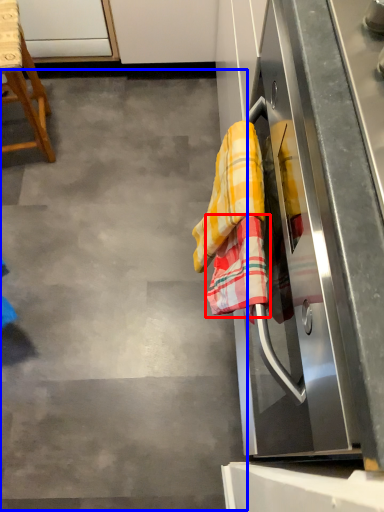
Question: Which point is closer to the camera, beach towel (highlighted by a red box) or concrete (highlighted by a blue box)?

Choices:
 (A) beach towel
 (B) concrete

Answer: (A)